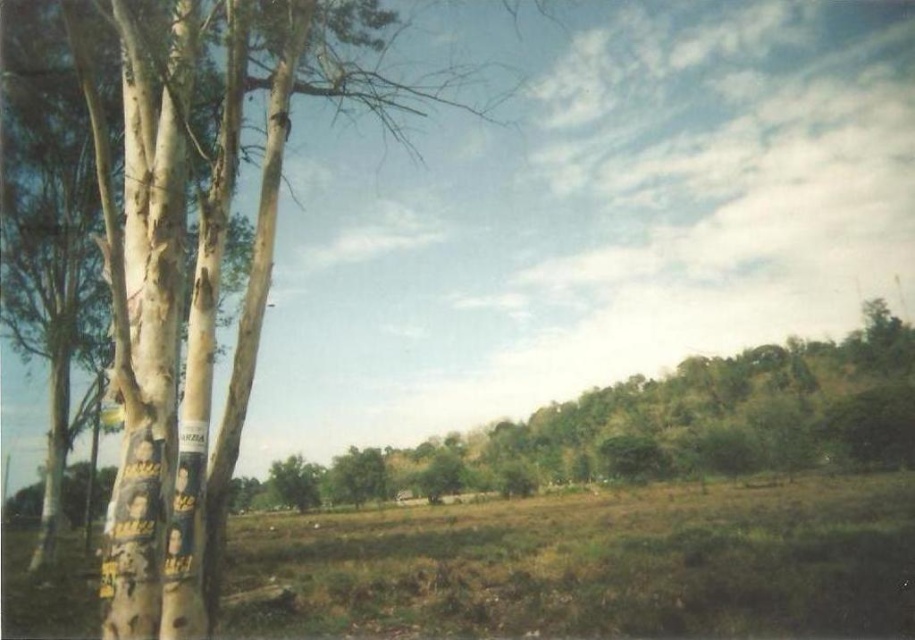
Question: Can you confirm if white rough bark tree at left is positioned above green leafy tree at center?

Choices:
 (A) yes
 (B) no

Answer: (A)

Question: Which point is closer to the camera?

Choices:
 (A) (171, 444)
 (B) (465, 477)

Answer: (A)

Question: Which point is closer to the camera?

Choices:
 (A) (686, 364)
 (B) (216, 204)

Answer: (B)

Question: Does white rough bark tree at left appear on the left side of green leafy tree at center?

Choices:
 (A) yes
 (B) no

Answer: (A)

Question: Where is white rough bark tree at left located in relation to green leafy tree at center in the image?

Choices:
 (A) right
 (B) left

Answer: (B)